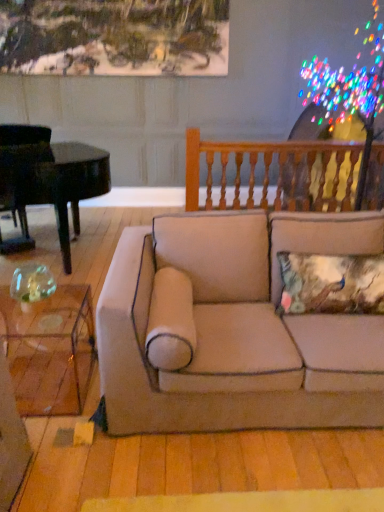
Question: Considering the positions of point (135, 261) and point (36, 309), is point (135, 261) closer or farther from the camera than point (36, 309)?

Choices:
 (A) closer
 (B) farther

Answer: (A)

Question: Based on their positions, is beige fabric couch at center located to the left or right of transparent glass coffee table at lower left?

Choices:
 (A) right
 (B) left

Answer: (A)

Question: Based on their relative distances, which object is farther from the wooden balusters at upper right?

Choices:
 (A) black polished piano at left
 (B) transparent glass coffee table at lower left
 (C) textured floral pillow at center
 (D) beige fabric couch at center

Answer: (B)

Question: Which of these objects is positioned farthest from the wooden balusters at upper right?

Choices:
 (A) beige fabric couch at center
 (B) black polished piano at left
 (C) textured floral pillow at center
 (D) transparent glass coffee table at lower left

Answer: (D)